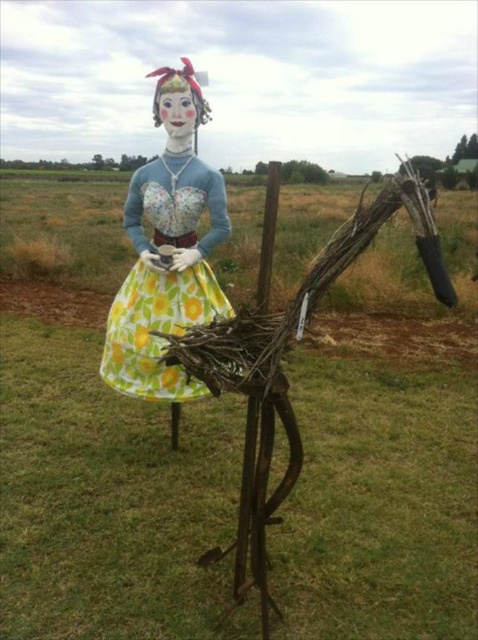
Question: From the image, what is the correct spatial relationship of yellow floral dress at center in relation to floral fabric dress at center?

Choices:
 (A) below
 (B) above

Answer: (A)

Question: Which object appears closest to the camera in this image?

Choices:
 (A) yellow floral dress at center
 (B) floral fabric dress at center

Answer: (B)

Question: Which point is farther from the camera taking this photo?

Choices:
 (A) (127, 205)
 (B) (156, 589)

Answer: (A)

Question: Is yellow floral dress at center to the right of floral fabric dress at center from the viewer's perspective?

Choices:
 (A) no
 (B) yes

Answer: (B)

Question: Does yellow floral dress at center appear under floral fabric dress at center?

Choices:
 (A) yes
 (B) no

Answer: (A)